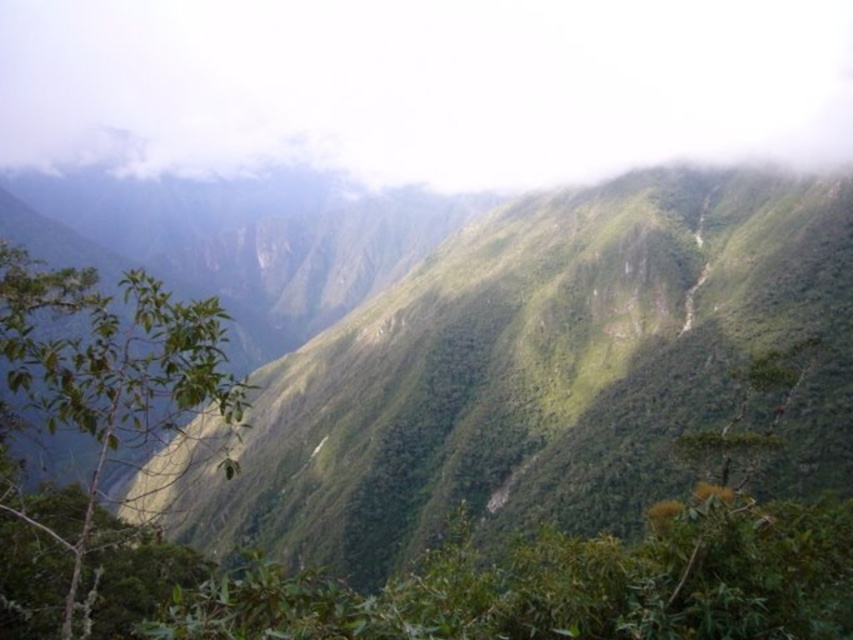
Who is positioned more to the right, white fluffy cloud at upper center or green leafy branch at lower left?

Positioned to the right is green leafy branch at lower left.

Looking at this image, does white fluffy cloud at upper center have a lesser height compared to green leafy branch at lower left?

Incorrect, white fluffy cloud at upper center's height does not fall short of green leafy branch at lower left's.

Which is in front, point (389, 77) or point (146, 307)?

Point (146, 307) is more forward.

Image resolution: width=853 pixels, height=640 pixels. Find the location of `white fluffy cloud at upper center`. white fluffy cloud at upper center is located at coordinates (425, 84).